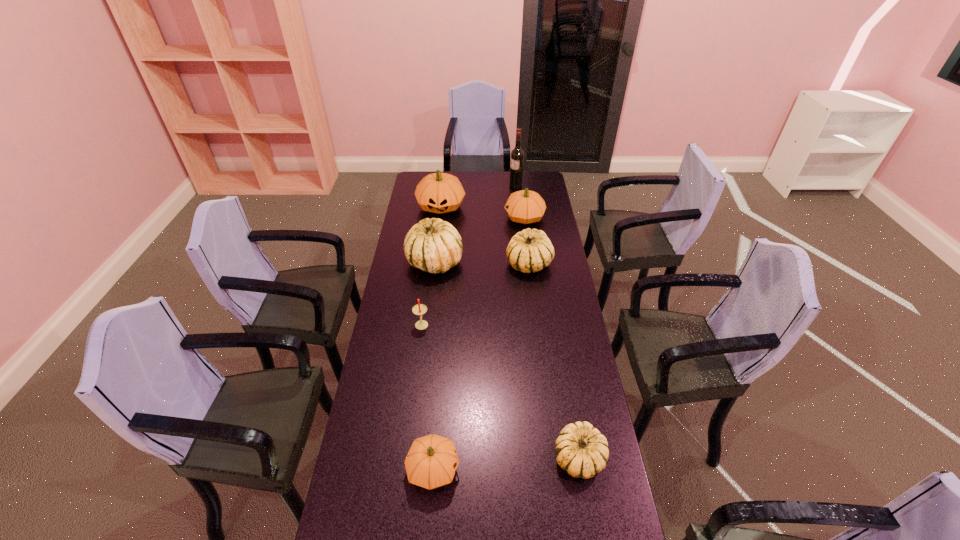
Locate an element on the screen. This screenshot has width=960, height=540. vacant point located 0.280m on the front and back of the wine bottle is located at coordinates (461, 186).

At what (x,y) coordinates should I click in order to perform the action: click on vacant space situated 0.250m on the front and back of the wine bottle. Please return your answer as a coordinate pair (x, y). Image resolution: width=960 pixels, height=540 pixels. Looking at the image, I should click on (466, 186).

Locate an element on the screen. The width and height of the screenshot is (960, 540). free spot located on the side of the biggest orange gourd with the carved face is located at coordinates (437, 241).

Find the location of `vacant space located 0.200m on the right of the biggest white gourd`. vacant space located 0.200m on the right of the biggest white gourd is located at coordinates (507, 262).

Where is `vacant region located on the side of the rightmost orange gourd with the carved face`? The width and height of the screenshot is (960, 540). vacant region located on the side of the rightmost orange gourd with the carved face is located at coordinates (431, 218).

At what (x,y) coordinates should I click in order to perform the action: click on blank space located on the side of the rightmost orange gourd with the carved face. Please return your answer as a coordinate pair (x, y). The height and width of the screenshot is (540, 960). Looking at the image, I should click on (477, 218).

In order to click on vacant space located 0.330m on the side of the rightmost orange gourd with the carved face in this screenshot , I will do `click(441, 218)`.

You are a GUI agent. You are given a task and a screenshot of the screen. Output one action in this format:
    pyautogui.click(x=<x>, y=<y>)
    Task: Click on the free region located 0.350m on the back of the second smallest white gourd
    
    Given the screenshot: What is the action you would take?
    pyautogui.click(x=522, y=209)

Identify the location of vacant space located 0.070m on the right of the candle. The height and width of the screenshot is (540, 960). (446, 323).

Identify the location of free point located 0.370m on the side of the smallest orange gourd with the carved face. The image size is (960, 540). (584, 469).